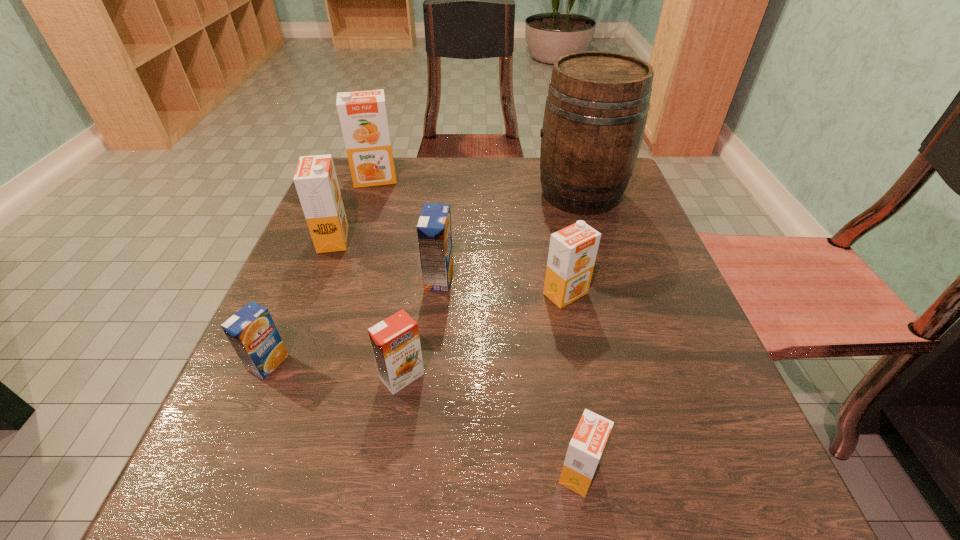
Find the location of a particular element. The height and width of the screenshot is (540, 960). free space at the near edge of the desktop is located at coordinates (577, 510).

This screenshot has width=960, height=540. Find the location of `free space at the left edge of the desktop`. free space at the left edge of the desktop is located at coordinates (322, 345).

You are a GUI agent. You are given a task and a screenshot of the screen. Output one action in this format:
    pyautogui.click(x=<x>, y=<y>)
    Task: Click on the free space at the right edge
    
    Given the screenshot: What is the action you would take?
    pyautogui.click(x=670, y=339)

Find the location of a particular element. Image resolution: width=960 pixels, height=540 pixels. vacant area at the far left corner of the desktop is located at coordinates (378, 194).

This screenshot has width=960, height=540. Identify the location of free space at the near right corner of the desktop. (770, 474).

Find the location of a particular element. vacant space that is in between the tallest object and the nearest object is located at coordinates (580, 333).

You are a GUI agent. You are given a task and a screenshot of the screen. Output one action in this format:
    pyautogui.click(x=<x>, y=<y>)
    Task: Click on the empty location between the second farthest orange orange juice and the second nearest orange orange juice
    
    Given the screenshot: What is the action you would take?
    pyautogui.click(x=368, y=308)

At what (x,y) coordinates should I click in order to perform the action: click on free space that is in between the tallest object and the tallest orange juice. Please return your answer as a coordinate pair (x, y). Looking at the image, I should click on (478, 186).

Image resolution: width=960 pixels, height=540 pixels. What are the coordinates of `unoccupied area between the nearest object and the third orange orange juice from left to right` in the screenshot? It's located at (491, 424).

At what (x,y) coordinates should I click in order to perform the action: click on vacant space that's between the sixth nearest object and the nearest orange orange juice. Please return your answer as a coordinate pair (x, y). Looking at the image, I should click on (456, 356).